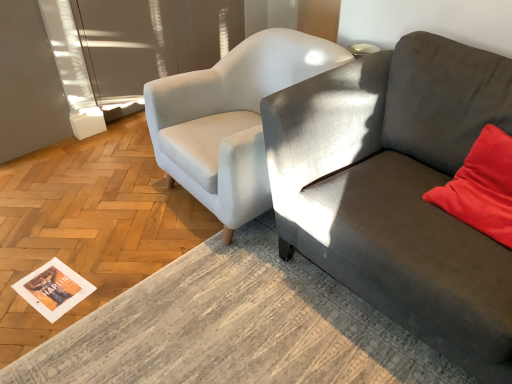
The width and height of the screenshot is (512, 384). Describe the element at coordinates (482, 187) in the screenshot. I see `velvet red pillow at right` at that location.

This screenshot has height=384, width=512. What do you see at coordinates (152, 40) in the screenshot? I see `transparent glass door at upper left` at bounding box center [152, 40].

I want to click on white fabric chair at center, so click(x=230, y=119).

What do you see at coordinates (53, 289) in the screenshot? Image resolution: width=512 pixels, height=384 pixels. I see `white paper magazine at lower left` at bounding box center [53, 289].

Measure the distance between point (499,361) and camera.

Point (499,361) and camera are 3.85 feet apart from each other.

Locate an element on the screen. The height and width of the screenshot is (384, 512). velvet red pillow at right is located at coordinates (482, 187).

Locate an element on the screen. pillow that is above the white paper magazine at lower left (from the image's perspective) is located at coordinates (482, 187).

In the scene shown: Is velvet red pillow at right at the back of white paper magazine at lower left?

No, velvet red pillow at right is not at the back of white paper magazine at lower left.

Which of these two, white paper magazine at lower left or velvet red pillow at right, stands taller?

With more height is velvet red pillow at right.

Does point (64, 288) appear closer or farther from the camera than point (452, 210)?

Point (64, 288) is positioned farther from the camera compared to point (452, 210).

Could you tell me if white paper magazine at lower left is facing white fabric chair at center?

No, white paper magazine at lower left is not turned towards white fabric chair at center.

Is white paper magazine at lower left smaller than white fabric chair at center?

Correct, white paper magazine at lower left occupies less space than white fabric chair at center.

Is white paper magazine at lower left with white fabric chair at center?

No.

Which of these two, textured gray couch at right or white fabric chair at center, stands shorter?

With less height is white fabric chair at center.

Does textured gray couch at right have a greater width compared to white fabric chair at center?

Correct, the width of textured gray couch at right exceeds that of white fabric chair at center.

Is point (419, 58) closer to camera compared to point (214, 210)?

Yes, it is in front of point (214, 210).

Which object is further away from the camera, textured gray couch at right or white fabric chair at center?

white fabric chair at center is further from the camera.

From the image's perspective, would you say transparent glass door at upper left is positioned over white fabric chair at center?

Correct, transparent glass door at upper left appears higher than white fabric chair at center in the image.

Is point (104, 50) more distant than point (234, 48)?

Yes, point (104, 50) is farther from viewer.

Is transparent glass door at upper left directly adjacent to white fabric chair at center?

They are not placed beside each other.

Looking at this image, is transparent glass door at upper left oriented away from white fabric chair at center?

That's not correct — transparent glass door at upper left is not looking away from white fabric chair at center.

Considering the sizes of objects textured gray couch at right and white paper magazine at lower left in the image provided, who is smaller, textured gray couch at right or white paper magazine at lower left?

With smaller size is white paper magazine at lower left.

Which is correct: textured gray couch at right is inside white paper magazine at lower left, or outside of it?

textured gray couch at right is not inside white paper magazine at lower left, it's outside.

This screenshot has width=512, height=384. In the image, there is a textured gray couch at right. In order to click on magazine below it (from a real-world perspective) in this screenshot , I will do `click(53, 289)`.

Is textured gray couch at right to the left or to the right of white paper magazine at lower left in the image?

textured gray couch at right is positioned on white paper magazine at lower left's right side.

Considering the points (37, 269) and (148, 23), which point is in front, point (37, 269) or point (148, 23)?

Point (37, 269)

This screenshot has width=512, height=384. In the image, there is a white paper magazine at lower left. Find the location of `glass door above it (from the image's perspective)`. glass door above it (from the image's perspective) is located at coordinates (152, 40).

Can you tell me how much white paper magazine at lower left and transparent glass door at upper left differ in facing direction?

white paper magazine at lower left and transparent glass door at upper left are facing 171 degrees away from each other.

How far apart are white paper magazine at lower left and transparent glass door at upper left?

white paper magazine at lower left is 1.60 meters from transparent glass door at upper left.

Where is `magazine behind the white fabric chair at center`? magazine behind the white fabric chair at center is located at coordinates (53, 289).

In the scene shown: Is white paper magazine at lower left at the back of white fabric chair at center?

No, white fabric chair at center is not facing away from white paper magazine at lower left.

Which is behind, point (253, 145) or point (46, 264)?

The point (46, 264) is farther from the camera.

Looking at this image, can you tell me how much white fabric chair at center and white paper magazine at lower left differ in facing direction?

The angle between the facing direction of white fabric chair at center and the facing direction of white paper magazine at lower left is 75.1 degrees.

This screenshot has height=384, width=512. I want to click on magazine beneath the velvet red pillow at right (from a real-world perspective), so click(x=53, y=289).

The image size is (512, 384). I want to click on magazine behind the white fabric chair at center, so click(x=53, y=289).

Based on their spatial positions, is velvet red pillow at right or transparent glass door at upper left further from white paper magazine at lower left?

transparent glass door at upper left is further to white paper magazine at lower left.

In the scene shown: Based on their spatial positions, is velvet red pillow at right or white fabric chair at center closer to textured gray couch at right?

Based on the image, velvet red pillow at right appears to be nearer to textured gray couch at right.

Based on their spatial positions, is white fabric chair at center or transparent glass door at upper left further from textured gray couch at right?

transparent glass door at upper left is positioned further to the anchor textured gray couch at right.

When comparing their distances from transparent glass door at upper left, does velvet red pillow at right or white fabric chair at center seem further?

velvet red pillow at right is positioned further to the anchor transparent glass door at upper left.

When comparing their distances from velvet red pillow at right, does transparent glass door at upper left or white fabric chair at center seem closer?

white fabric chair at center lies closer to velvet red pillow at right than the other object.

Looking at the image, which one is located further to white paper magazine at lower left, white fabric chair at center or velvet red pillow at right?

velvet red pillow at right lies further to white paper magazine at lower left than the other object.

Estimate the real-world distances between objects in this image. Which object is further from textured gray couch at right, transparent glass door at upper left or velvet red pillow at right?

transparent glass door at upper left is positioned further to the anchor textured gray couch at right.

From the image, which object appears to be farther from transparent glass door at upper left, textured gray couch at right or velvet red pillow at right?

Among the two, velvet red pillow at right is located further to transparent glass door at upper left.

At what (x,y) coordinates should I click in order to perform the action: click on chair between textured gray couch at right and transparent glass door at upper left in the front-back direction. Please return your answer as a coordinate pair (x, y). Looking at the image, I should click on (230, 119).

In order to click on studio couch situated between white paper magazine at lower left and velvet red pillow at right from left to right in this screenshot , I will do `click(398, 190)`.

Identify the location of glass door between white paper magazine at lower left and textured gray couch at right in the horizontal direction. This screenshot has height=384, width=512. (152, 40).

You are a GUI agent. You are given a task and a screenshot of the screen. Output one action in this format:
    pyautogui.click(x=<x>, y=<y>)
    Task: Click on the chair between white paper magazine at lower left and velvet red pillow at right
    This screenshot has height=384, width=512.
    Given the screenshot: What is the action you would take?
    pyautogui.click(x=230, y=119)